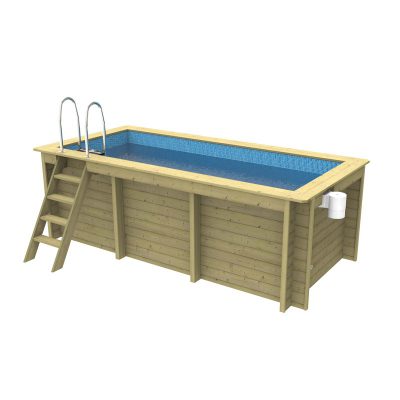
What are the coordinates of `inside step` in the screenshot? It's located at (96, 149).